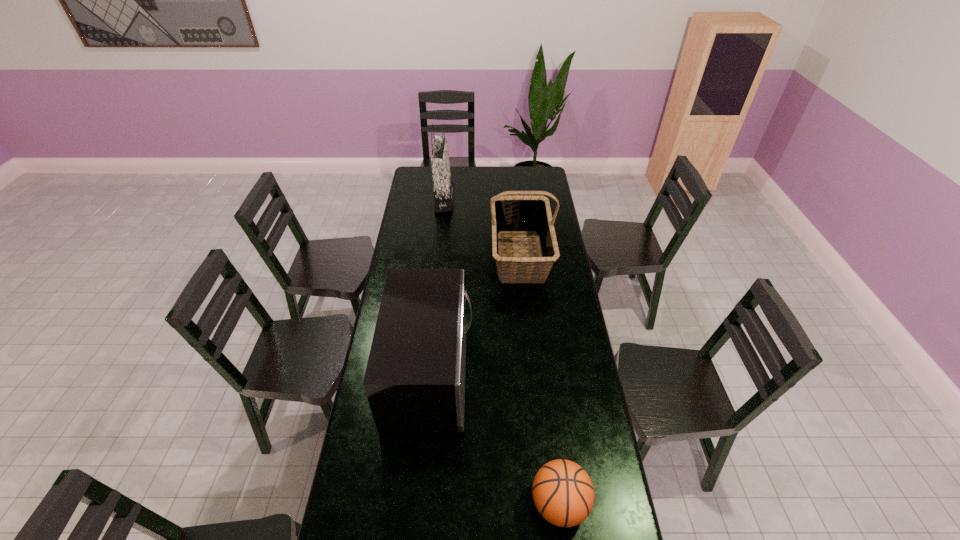
At what (x,y) coordinates should I click in order to perform the action: click on the farthest object. Please return your answer as a coordinate pair (x, y). This screenshot has width=960, height=540. Looking at the image, I should click on (443, 185).

The image size is (960, 540). I want to click on shopping bag, so click(x=443, y=185).

Image resolution: width=960 pixels, height=540 pixels. Find the location of `basket`. basket is located at coordinates (519, 214).

Where is `the second farthest object`? the second farthest object is located at coordinates (519, 214).

Locate an element on the screen. the second shortest object is located at coordinates (414, 381).

This screenshot has height=540, width=960. I want to click on microwave oven, so click(x=414, y=381).

Find the location of a particular element. Image resolution: width=960 pixels, height=540 pixels. the nearest object is located at coordinates (563, 493).

You are a GUI agent. You are given a task and a screenshot of the screen. Output one action in this format:
    pyautogui.click(x=<x>, y=<y>)
    Task: Click on the basketball
    
    Given the screenshot: What is the action you would take?
    pyautogui.click(x=563, y=493)

Locate an element on the screen. This screenshot has width=960, height=540. blank area located 0.300m on the front of the tallest object with the design is located at coordinates click(x=506, y=200).

Where is `vacant space located 0.300m by the handle of the basket`? vacant space located 0.300m by the handle of the basket is located at coordinates click(530, 343).